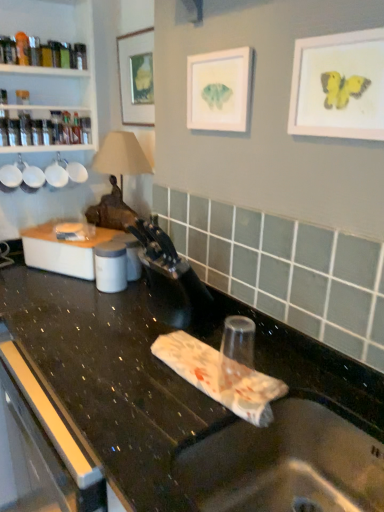
Question: Which direction should I rotate to face matte paper picture frame at center, arranged as the second picture frame when viewed from the left, — up or down?

Choices:
 (A) up
 (B) down

Answer: (A)

Question: Can you confirm if white plastic container at left is positioned to the right of metallic stainless steel sink at lower center?

Choices:
 (A) yes
 (B) no

Answer: (B)

Question: Would you say white plastic container at left contains metallic stainless steel sink at lower center?

Choices:
 (A) yes
 (B) no

Answer: (B)

Question: Is white plastic container at left outside metallic stainless steel sink at lower center?

Choices:
 (A) no
 (B) yes

Answer: (B)

Question: Can you confirm if white plastic container at left is smaller than metallic stainless steel sink at lower center?

Choices:
 (A) yes
 (B) no

Answer: (A)

Question: Is white plastic container at left taller than metallic stainless steel sink at lower center?

Choices:
 (A) no
 (B) yes

Answer: (B)

Question: Is white plastic container at left turned away from metallic stainless steel sink at lower center?

Choices:
 (A) no
 (B) yes

Answer: (A)

Question: Does matte paper picture frame at center, arranged as the second picture frame when viewed from the left, have a smaller size compared to metallic stainless steel sink at lower center?

Choices:
 (A) no
 (B) yes

Answer: (B)

Question: Is matte paper picture frame at center, marked as the second picture frame in a back-to-front arrangement, looking in the opposite direction of metallic stainless steel sink at lower center?

Choices:
 (A) yes
 (B) no

Answer: (B)

Question: Can you confirm if matte paper picture frame at center, marked as the second picture frame in a back-to-front arrangement, is shorter than metallic stainless steel sink at lower center?

Choices:
 (A) yes
 (B) no

Answer: (B)

Question: Is matte paper picture frame at center, marked as the second picture frame in a back-to-front arrangement, positioned beyond the bounds of metallic stainless steel sink at lower center?

Choices:
 (A) no
 (B) yes

Answer: (B)

Question: Is matte paper picture frame at center, marked as the second picture frame in a front-to-back arrangement, thinner than metallic stainless steel sink at lower center?

Choices:
 (A) no
 (B) yes

Answer: (B)

Question: Is matte paper picture frame at center, marked as the second picture frame in a front-to-back arrangement, wider than metallic stainless steel sink at lower center?

Choices:
 (A) yes
 (B) no

Answer: (B)

Question: Can you confirm if metallic stainless steel sink at lower center is positioned to the left of white plastic container at left?

Choices:
 (A) yes
 (B) no

Answer: (B)